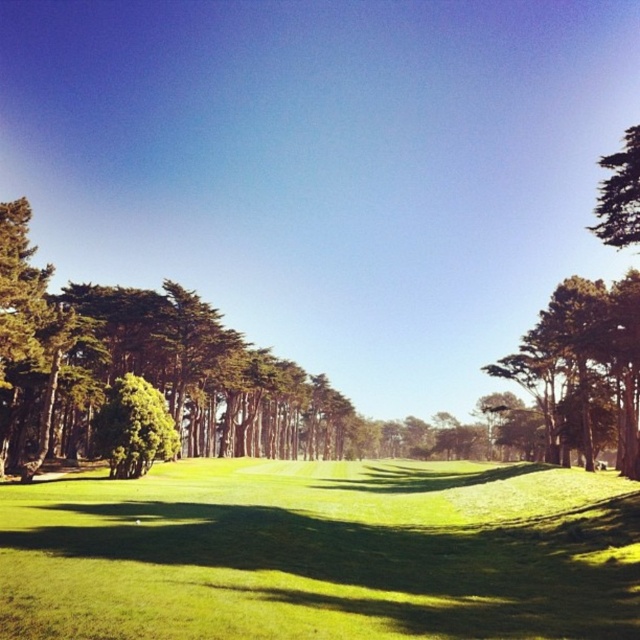
Question: Can you confirm if green leafy tree at left is positioned to the right of green leafy tree at upper right?

Choices:
 (A) yes
 (B) no

Answer: (B)

Question: Which object appears farthest from the camera in this image?

Choices:
 (A) green leafy tree at upper right
 (B) green leafy tree at center
 (C) green leafy tree at left

Answer: (B)

Question: Which point is closer to the camera?

Choices:
 (A) green leafy tree at left
 (B) green grass at center
 (C) green leafy tree at upper right
 (D) green leafy tree at center

Answer: (B)

Question: Which point is closer to the camera?

Choices:
 (A) (605, 179)
 (B) (10, 541)
 (C) (269, 378)

Answer: (B)

Question: In this image, where is green grass at center located relative to green leafy tree at center?

Choices:
 (A) left
 (B) right

Answer: (B)

Question: In this image, where is green grass at center located relative to green leafy tree at center?

Choices:
 (A) right
 (B) left

Answer: (A)